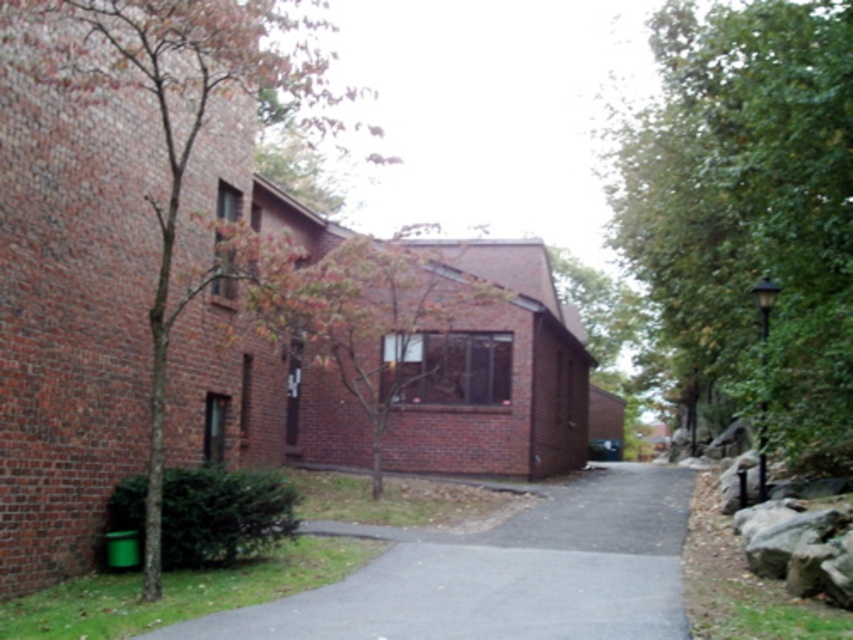
Locate an element on the screen. green leafy tree at right is located at coordinates [x=747, y=212].

Does point (668, 189) lie in front of point (171, 52)?

No, it is not.

Which is in front, point (793, 13) or point (204, 280)?

Point (204, 280) is more forward.

You are a GUI agent. You are given a task and a screenshot of the screen. Output one action in this format:
    pyautogui.click(x=<x>, y=<y>)
    Task: Click on the green leafy tree at right
    
    Given the screenshot: What is the action you would take?
    pyautogui.click(x=747, y=212)

Is gray asphalt pavement at center wider than brown textured tree at left?

Yes.

Find the location of a particular element. gray asphalt pavement at center is located at coordinates (502, 573).

Is point (709, 304) behind point (627, 513)?

Yes.

Which is behind, point (747, 401) or point (676, 598)?

The point (747, 401) is more distant.

Where is `green leafy tree at right`? The image size is (853, 640). green leafy tree at right is located at coordinates (747, 212).